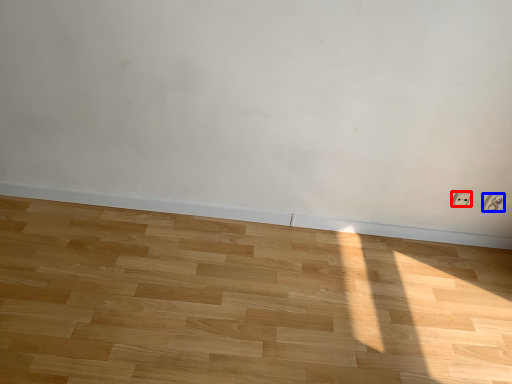
Question: Which object is further to the camera taking this photo, electric outlet (highlighted by a red box) or electric outlet (highlighted by a blue box)?

Choices:
 (A) electric outlet
 (B) electric outlet

Answer: (A)